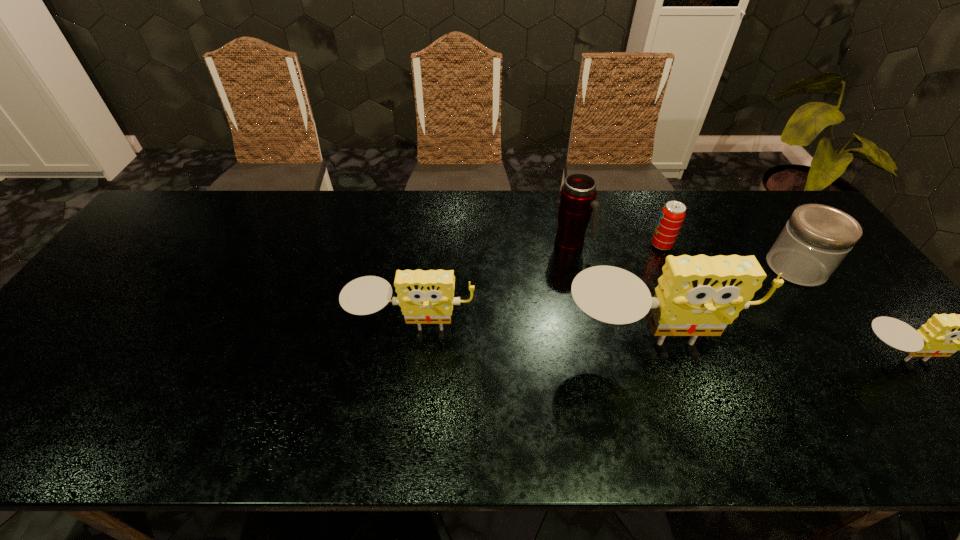
In the current image, all sponges are evenly spaced. To maintain this equal spacing, where should an additional sponge be placed on the left? Please point out a free spot. Please provide its 2D coordinates. Your answer should be formatted as a tuple, i.e. [(x, y)], where the tuple contains the x and y coordinates of a point satisfying the conditions above.

[(191, 318)]